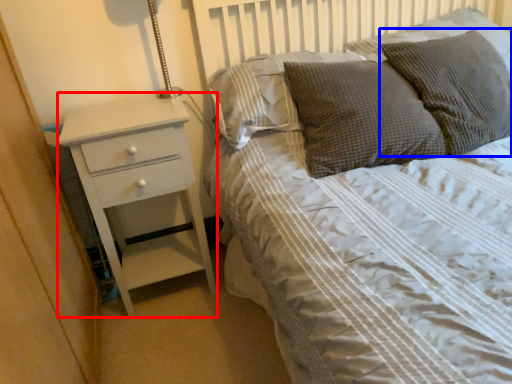
Question: Which object is closer to the camera taking this photo, chest of drawers (highlighted by a red box) or pillow (highlighted by a blue box)?

Choices:
 (A) chest of drawers
 (B) pillow

Answer: (B)